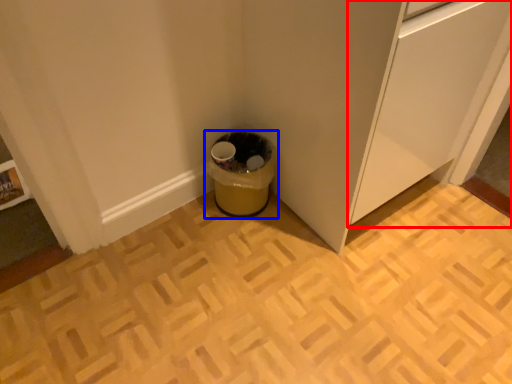
Question: Which object appears farthest to the camera in this image, cabinetry (highlighted by a red box) or waste container (highlighted by a blue box)?

Choices:
 (A) cabinetry
 (B) waste container

Answer: (B)